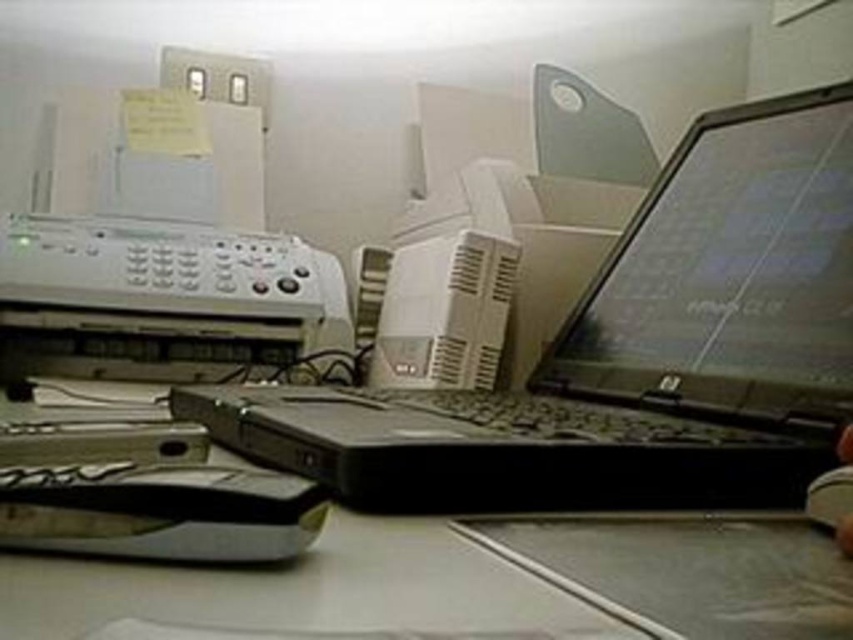
You are organizing your desk and need to move the black plastic laptop at center and the white plastic printer at upper left. Which object is located above the other?

The white plastic printer at upper left is located above the black plastic laptop at center because the black plastic laptop at center is positioned under the white plastic printer at upper left.

You are standing at the origin point in the workspace. There are two points marked in the scene. Which point is closer to you, point (38,141) or point (285,632)?

Point (285,632) is closer to you because it is in front of point (38,141).

You are organizing the office and need to place a new keyboard that requires 1 meter of space. You have the black plastic computer desk at center and the white plastic printer at center in front of you. Which object can accommodate the keyboard based on their sizes?

The white plastic printer at center is larger than the black plastic computer desk at center, so the keyboard might fit better on the white plastic printer at center if there is sufficient space available.